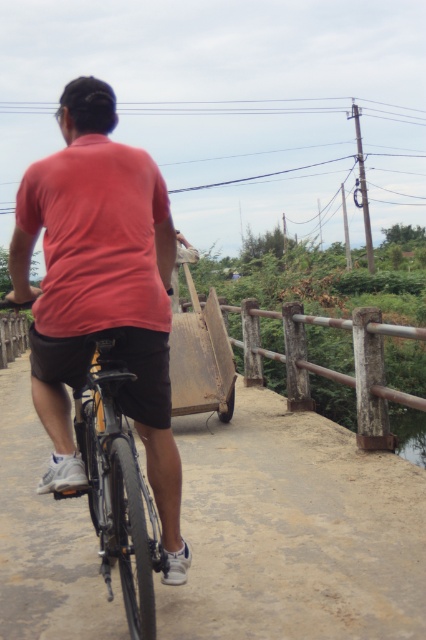
Question: Which is farther from the matte black bicycle at center?

Choices:
 (A) matte red shirt at center
 (B) shiny metallic bicycle at center

Answer: (A)

Question: Which of the following is the closest to the observer?

Choices:
 (A) matte black bicycle at center
 (B) matte red shirt at center
 (C) shiny metallic bicycle at center

Answer: (C)

Question: Is matte black bicycle at center further to the viewer compared to matte red shirt at center?

Choices:
 (A) no
 (B) yes

Answer: (B)

Question: Can you confirm if matte black bicycle at center is smaller than matte red shirt at center?

Choices:
 (A) yes
 (B) no

Answer: (A)

Question: Based on their relative distances, which object is farther from the matte red shirt at center?

Choices:
 (A) matte black bicycle at center
 (B) shiny metallic bicycle at center

Answer: (A)

Question: Is matte black bicycle at center positioned at the back of matte red shirt at center?

Choices:
 (A) yes
 (B) no

Answer: (A)